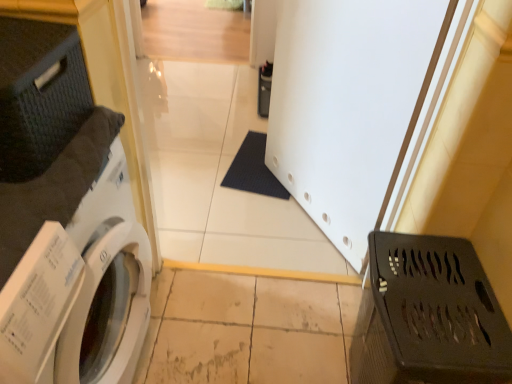
Question: Does black plastic laundry basket at lower right appear on the right side of white glossy washing machine at left?

Choices:
 (A) yes
 (B) no

Answer: (A)

Question: From a real-world perspective, is black plastic laundry basket at lower right located beneath white glossy washing machine at left?

Choices:
 (A) yes
 (B) no

Answer: (A)

Question: Is black plastic laundry basket at lower right positioned beyond the bounds of white glossy washing machine at left?

Choices:
 (A) yes
 (B) no

Answer: (A)

Question: Is black plastic laundry basket at lower right smaller than white glossy washing machine at left?

Choices:
 (A) no
 (B) yes

Answer: (B)

Question: Can you confirm if black plastic laundry basket at lower right is bigger than white glossy washing machine at left?

Choices:
 (A) yes
 (B) no

Answer: (B)

Question: Is black plastic laundry basket at lower right not close to white glossy washing machine at left?

Choices:
 (A) no
 (B) yes

Answer: (A)

Question: Is white glossy washing machine at left beside white matte screen door at center?

Choices:
 (A) no
 (B) yes

Answer: (A)

Question: From the image's perspective, is white glossy washing machine at left beneath white matte screen door at center?

Choices:
 (A) yes
 (B) no

Answer: (A)

Question: Does white glossy washing machine at left have a greater height compared to white matte screen door at center?

Choices:
 (A) yes
 (B) no

Answer: (B)

Question: Considering the relative sizes of white glossy washing machine at left and white matte screen door at center in the image provided, is white glossy washing machine at left wider than white matte screen door at center?

Choices:
 (A) yes
 (B) no

Answer: (A)

Question: Is white glossy washing machine at left at the left side of white matte screen door at center?

Choices:
 (A) no
 (B) yes

Answer: (B)

Question: Can you confirm if white glossy washing machine at left is smaller than white matte screen door at center?

Choices:
 (A) no
 (B) yes

Answer: (A)

Question: Can you confirm if white glossy washing machine at left is taller than black plastic laundry basket at lower right?

Choices:
 (A) no
 (B) yes

Answer: (B)